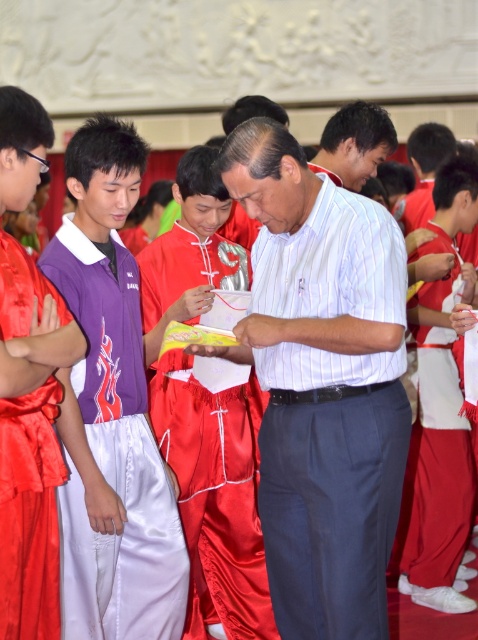
Question: Which object is closer to the camera taking this photo?

Choices:
 (A) silky red robe at center
 (B) white striped shirt at center
 (C) purple satin robe at left

Answer: (C)

Question: Does satin red robe at center appear on the left side of matte white shirt at center?

Choices:
 (A) yes
 (B) no

Answer: (A)

Question: Does silky red robe at left appear on the right side of matte white shirt at center?

Choices:
 (A) yes
 (B) no

Answer: (B)

Question: Which of these objects is positioned closest to the matte white shirt at center?

Choices:
 (A) silky red robe at left
 (B) purple satin robe at left

Answer: (B)

Question: Can you confirm if white striped shirt at center is bigger than purple satin robe at left?

Choices:
 (A) no
 (B) yes

Answer: (B)

Question: Which of these objects is positioned farthest from the matte white shirt at center?

Choices:
 (A) purple satin robe at left
 (B) white striped shirt at center

Answer: (A)